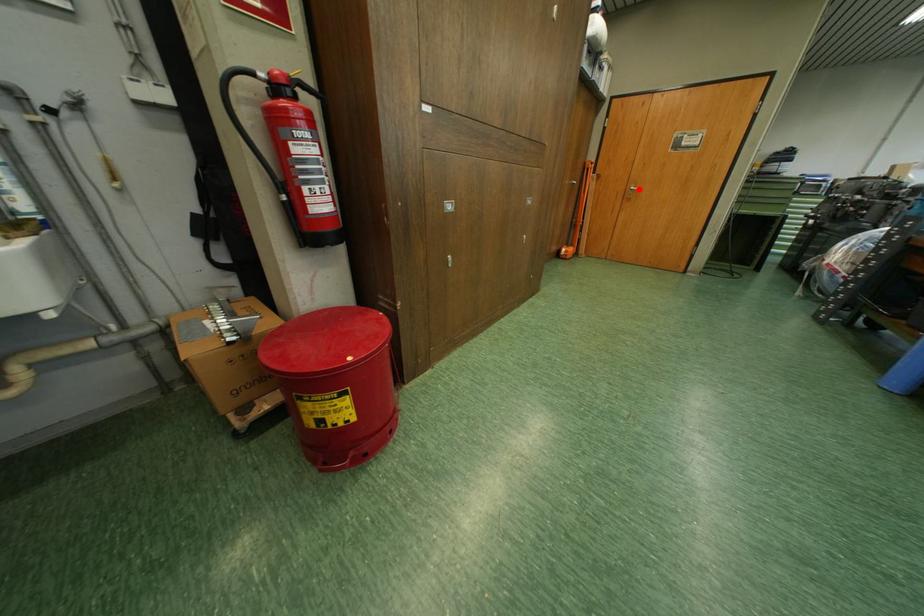
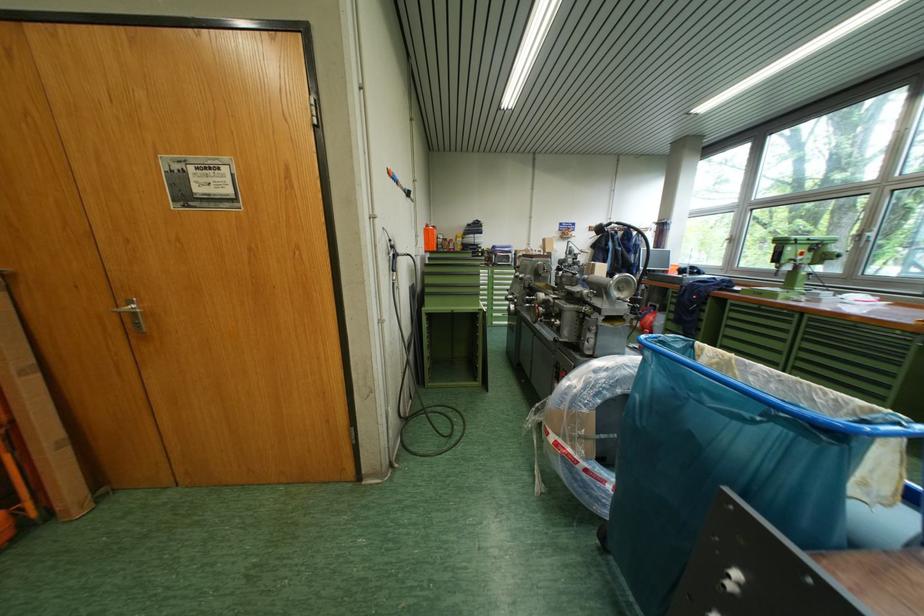
In the second image, find the point that corresponds to the highlighted location in the first image.

(131, 305)